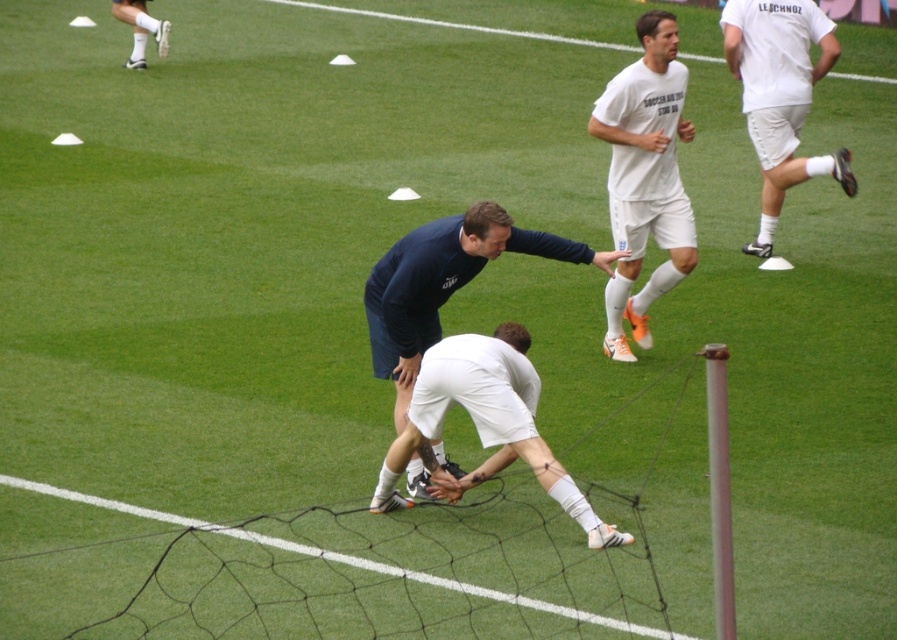
Question: Is white matte shorts at right in front of dark blue fabric shirt at center?

Choices:
 (A) yes
 (B) no

Answer: (B)

Question: Which of the following is the farthest from the observer?

Choices:
 (A) white matte shorts at right
 (B) white matte socks at upper left
 (C) white matte shorts at center
 (D) dark blue fabric shirt at center

Answer: (B)

Question: Can you confirm if dark blue fabric shirt at center is positioned to the left of white matte socks at upper left?

Choices:
 (A) yes
 (B) no

Answer: (B)

Question: Which object is the closest to the white matte socks at upper left?

Choices:
 (A) white matte shorts at center
 (B) white matte shorts at right
 (C) dark blue fabric shirt at center

Answer: (B)

Question: Which point is farther to the camera?

Choices:
 (A) white matte shorts at center
 (B) white matte shorts at right
 (C) white matte socks at upper left
 (D) dark blue fabric shirt at center

Answer: (C)

Question: Is white matte shorts at center to the right of white matte shorts at right from the viewer's perspective?

Choices:
 (A) yes
 (B) no

Answer: (B)